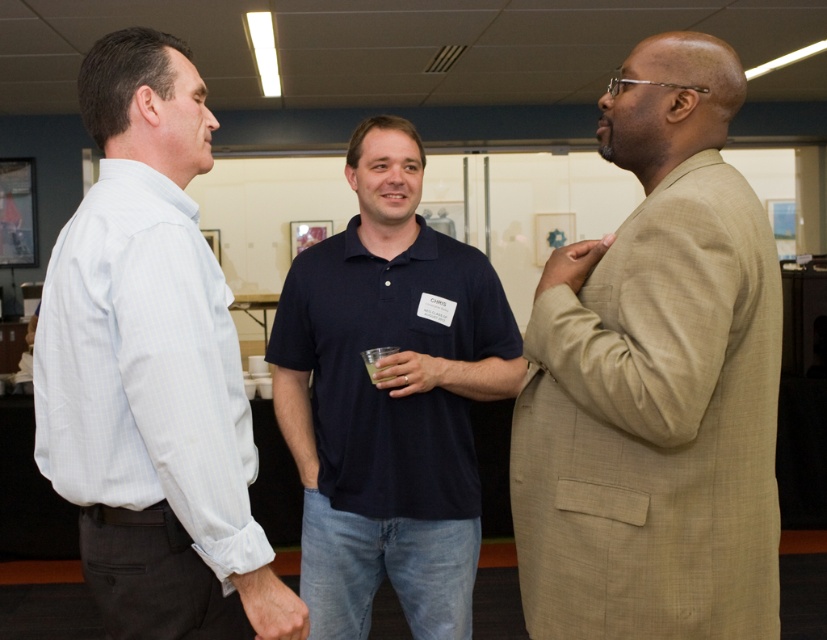
You are organizing a photo shoot and need to arrange the subjects in order from left to right based on their clothing. Given the tan textured suit at right and the light blue striped shirt at left, which clothing item should be placed first from the left side?

The light blue striped shirt at left should be placed first from the left side since it is positioned to the left of the tan textured suit at right.

Based on the scene description, where exactly is the dark blue cotton polo shirt at center located in the image?

The dark blue cotton polo shirt at center is located at point 0.623 in the x coordinate and 0.472 in the y coordinate.

You are organizing a charity event and need to arrange seating based on the width of the attendees. You have two guests wearing the tan textured suit at right and the light blue striped shirt at left. Which guest requires a wider seat?

The light blue striped shirt at left requires a wider seat because the tan textured suit at right is narrower than the light blue striped shirt at left.